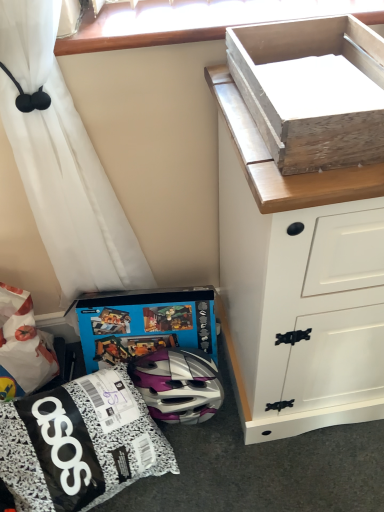
What do you see at coordinates (79, 444) in the screenshot?
I see `matte black helmet at lower center` at bounding box center [79, 444].

Where is `matte black helmet at lower center`? Image resolution: width=384 pixels, height=512 pixels. matte black helmet at lower center is located at coordinates (79, 444).

Find the location of `blue cardboard box at lower center`. blue cardboard box at lower center is located at coordinates (145, 324).

The width and height of the screenshot is (384, 512). Describe the element at coordinates (312, 91) in the screenshot. I see `wooden box at upper right` at that location.

Where is `matte black helmet at lower center`? This screenshot has width=384, height=512. matte black helmet at lower center is located at coordinates tap(79, 444).

From a real-world perspective, is wooden box at upper right physically below matte black helmet at lower center?

No.

Is wooden box at upper right surrounding matte black helmet at lower center?

No, wooden box at upper right does not contain matte black helmet at lower center.

Based on the photo, how many degrees apart are the facing directions of wooden box at upper right and matte black helmet at lower center?

67.9 degrees.

Which of these two, wooden box at upper right or matte black helmet at lower center, is wider?

matte black helmet at lower center.

From a real-world perspective, who is located lower, white painted wood chest of drawers at upper right or wooden box at upper right?

From a 3D spatial view, white painted wood chest of drawers at upper right is below.

Is point (237, 373) closer to camera compared to point (326, 23)?

No, (237, 373) is further to viewer.

Is white painted wood chest of drawers at upper right shorter than wooden box at upper right?

Incorrect, the height of white painted wood chest of drawers at upper right does not fall short of that of wooden box at upper right.

How many degrees apart are the facing directions of white painted wood chest of drawers at upper right and wooden box at upper right?

The angular difference between white painted wood chest of drawers at upper right and wooden box at upper right is 0.000102 degrees.

This screenshot has height=512, width=384. Identify the location of cardboard box below the wooden box at upper right (from a real-world perspective). click(x=145, y=324).

Between wooden box at upper right and blue cardboard box at lower center, which one has smaller width?

blue cardboard box at lower center.

Does wooden box at upper right contain blue cardboard box at lower center?

Actually, blue cardboard box at lower center is outside wooden box at upper right.

Which is more to the right, matte black helmet at lower center or wooden box at upper right?

From the viewer's perspective, wooden box at upper right appears more on the right side.

Is matte black helmet at lower center not close to wooden box at upper right?

They are positioned close to each other.

Would you say matte black helmet at lower center contains wooden box at upper right?

That's incorrect, wooden box at upper right is not inside matte black helmet at lower center.

Is the position of matte black helmet at lower center less distant than that of wooden box at upper right?

No, it is behind wooden box at upper right.

Could you tell me if white painted wood chest of drawers at upper right is facing matte black helmet at lower center?

No, white painted wood chest of drawers at upper right is not aimed at matte black helmet at lower center.

In the image, is white painted wood chest of drawers at upper right positioned in front of or behind matte black helmet at lower center?

white painted wood chest of drawers at upper right is in front of matte black helmet at lower center.

Where is `kit behind the white painted wood chest of drawers at upper right`? The width and height of the screenshot is (384, 512). kit behind the white painted wood chest of drawers at upper right is located at coordinates (79, 444).

From a real-world perspective, is white painted wood chest of drawers at upper right located beneath matte black helmet at lower center?

No, from a real-world perspective, white painted wood chest of drawers at upper right is not beneath matte black helmet at lower center.

Which is behind, matte black helmet at lower center or white painted wood chest of drawers at upper right?

matte black helmet at lower center.

Does point (90, 489) come behind point (322, 248)?

Yes, point (90, 489) is behind point (322, 248).

Is matte black helmet at lower center not near white painted wood chest of drawers at upper right?

No.

Is white painted wood chest of drawers at upper right surrounded by wooden box at upper right?

That's incorrect, white painted wood chest of drawers at upper right is not inside wooden box at upper right.

How distant is wooden box at upper right from white painted wood chest of drawers at upper right?

wooden box at upper right and white painted wood chest of drawers at upper right are 10.29 inches apart from each other.

Does wooden box at upper right appear on the right side of white painted wood chest of drawers at upper right?

No.

Which is in front, point (285, 98) or point (378, 222)?

Positioned in front is point (285, 98).

Identify the location of box above the matte black helmet at lower center (from the image's perspective). This screenshot has width=384, height=512. (312, 91).

Find the location of a particular element. box in front of the white painted wood chest of drawers at upper right is located at coordinates (312, 91).

Considering their positions, is wooden box at upper right positioned further to blue cardboard box at lower center than white painted wood chest of drawers at upper right?

The object further to blue cardboard box at lower center is wooden box at upper right.

Based on their spatial positions, is wooden box at upper right or matte black helmet at lower center closer to blue cardboard box at lower center?

matte black helmet at lower center lies closer to blue cardboard box at lower center than the other object.

From the image, which object appears to be farther from matte black helmet at lower center, blue cardboard box at lower center or wooden box at upper right?

Based on the image, wooden box at upper right appears to be further to matte black helmet at lower center.

Based on their spatial positions, is blue cardboard box at lower center or white painted wood chest of drawers at upper right closer to matte black helmet at lower center?

blue cardboard box at lower center lies closer to matte black helmet at lower center than the other object.

Looking at the image, which one is located closer to blue cardboard box at lower center, matte black helmet at lower center or white painted wood chest of drawers at upper right?

The object closer to blue cardboard box at lower center is matte black helmet at lower center.

Based on their spatial positions, is white painted wood chest of drawers at upper right or matte black helmet at lower center further from blue cardboard box at lower center?

Among the two, white painted wood chest of drawers at upper right is located further to blue cardboard box at lower center.

Estimate the real-world distances between objects in this image. Which object is further from blue cardboard box at lower center, matte black helmet at lower center or wooden box at upper right?

Based on the image, wooden box at upper right appears to be further to blue cardboard box at lower center.

Based on their spatial positions, is blue cardboard box at lower center or white painted wood chest of drawers at upper right closer to wooden box at upper right?

Based on the image, white painted wood chest of drawers at upper right appears to be nearer to wooden box at upper right.

The width and height of the screenshot is (384, 512). Identify the location of cardboard box between matte black helmet at lower center and white painted wood chest of drawers at upper right from left to right. (145, 324).

Identify the location of cardboard box between wooden box at upper right and matte black helmet at lower center in the vertical direction. The width and height of the screenshot is (384, 512). coord(145,324).

Locate an element on the screen. chest of drawers between wooden box at upper right and blue cardboard box at lower center along the z-axis is located at coordinates (296, 282).

Identify the location of the chest of drawers that lies between wooden box at upper right and matte black helmet at lower center from top to bottom. (296, 282).